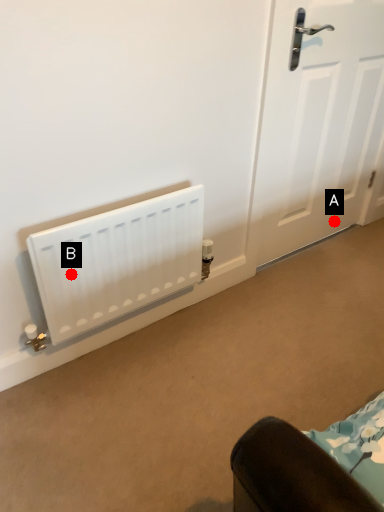
Question: Two points are circled on the image, labeled by A and B beside each circle. Among these points, which one is nearest to the camera?

Choices:
 (A) A is closer
 (B) B is closer

Answer: (B)